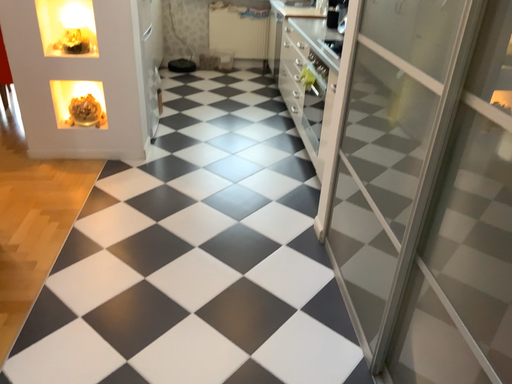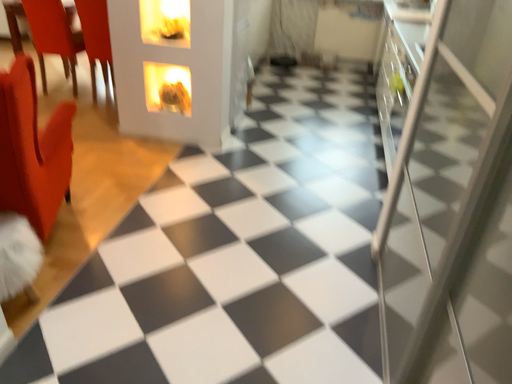
Question: Which way did the camera rotate in the video?

Choices:
 (A) rotated left
 (B) rotated right

Answer: (A)